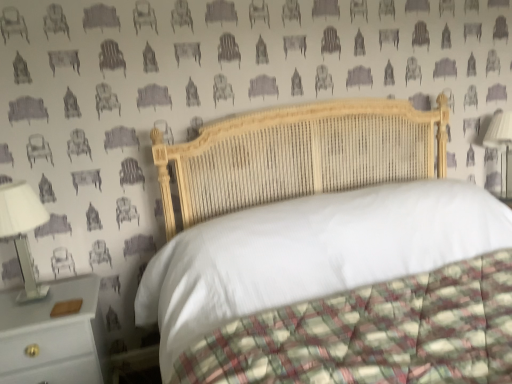
You are a GUI agent. You are given a task and a screenshot of the screen. Output one action in this format:
    pyautogui.click(x=<x>, y=<y>)
    Task: Click on the wooden bed at center
    The height and width of the screenshot is (384, 512).
    Given the screenshot: What is the action you would take?
    pyautogui.click(x=312, y=120)

Image resolution: width=512 pixels, height=384 pixels. Describe the element at coordinates (502, 148) in the screenshot. I see `white fabric lampshade at right, marked as the second bedside lamp in a left-to-right arrangement` at that location.

What do you see at coordinates (22, 230) in the screenshot? I see `white glossy bedside lamp at left, which appears as the 2th bedside lamp when viewed from the top` at bounding box center [22, 230].

The image size is (512, 384). Identify the location of wooden bed at center. (312, 120).

From a real-world perspective, who is located higher, white wood nightstand at lower left or white fabric lampshade at right, which appears as the second bedside lamp when ordered from the bottom?

white fabric lampshade at right, which appears as the second bedside lamp when ordered from the bottom.

In terms of width, does white wood nightstand at lower left look wider or thinner when compared to white fabric lampshade at right, which is the first bedside lamp in right-to-left order?

Clearly, white wood nightstand at lower left has more width compared to white fabric lampshade at right, which is the first bedside lamp in right-to-left order.

Which is in front, white wood nightstand at lower left or white fabric lampshade at right, which is the first bedside lamp in right-to-left order?

white wood nightstand at lower left is closer to the camera.

Would you say white wood nightstand at lower left is to the left or to the right of white fabric lampshade at right, which is the first bedside lamp in right-to-left order, in the picture?

white wood nightstand at lower left is positioned on white fabric lampshade at right, which is the first bedside lamp in right-to-left order,'s left side.

In the image, is wooden bed at center positioned in front of or behind white wood nightstand at lower left?

wooden bed at center is positioned closer to the viewer than white wood nightstand at lower left.

Is wooden bed at center oriented towards white wood nightstand at lower left?

No, wooden bed at center is not facing towards white wood nightstand at lower left.

How many degrees apart are the facing directions of wooden bed at center and white wood nightstand at lower left?

There is a 0.00264-degree angle between the facing directions of wooden bed at center and white wood nightstand at lower left.

From the picture: From the image's perspective, would you say wooden bed at center is positioned over white fabric lampshade at right, marked as the second bedside lamp in a left-to-right arrangement?

Incorrect, from the image's perspective, wooden bed at center is lower than white fabric lampshade at right, marked as the second bedside lamp in a left-to-right arrangement.

Which is more to the left, wooden bed at center or white fabric lampshade at right, marked as the first bedside lamp in a top-to-bottom arrangement?

wooden bed at center.

Looking at this image, can you confirm if wooden bed at center is taller than white fabric lampshade at right, which is the first bedside lamp from back to front?

Yes.

Can you confirm if wooden bed at center is taller than white glossy bedside lamp at left, which is counted as the first bedside lamp, starting from the bottom?

Correct, wooden bed at center is much taller as white glossy bedside lamp at left, which is counted as the first bedside lamp, starting from the bottom.

Does wooden bed at center lie in front of white glossy bedside lamp at left, which appears as the 2th bedside lamp when viewed from the right?

Yes, wooden bed at center is closer to the viewer.

Can you confirm if wooden bed at center is thinner than white glossy bedside lamp at left, arranged as the first bedside lamp when viewed from the front?

In fact, wooden bed at center might be wider than white glossy bedside lamp at left, arranged as the first bedside lamp when viewed from the front.

Is white glossy bedside lamp at left, which appears as the 2th bedside lamp when viewed from the right, completely or partially inside wooden bed at center?

No, white glossy bedside lamp at left, which appears as the 2th bedside lamp when viewed from the right, is not a part of wooden bed at center.

Which object is wider, white glossy bedside lamp at left, which appears as the 2th bedside lamp when viewed from the top, or white fabric lampshade at right, marked as the second bedside lamp in a left-to-right arrangement?

white fabric lampshade at right, marked as the second bedside lamp in a left-to-right arrangement.

Is white glossy bedside lamp at left, which is the 1th bedside lamp in left-to-right order, facing away from white fabric lampshade at right, marked as the second bedside lamp in a left-to-right arrangement?

No, white fabric lampshade at right, marked as the second bedside lamp in a left-to-right arrangement, is not at the back of white glossy bedside lamp at left, which is the 1th bedside lamp in left-to-right order.

Visually, is white glossy bedside lamp at left, which is the 2th bedside lamp in back-to-front order, positioned to the left or to the right of white fabric lampshade at right, the 2th bedside lamp in the front-to-back sequence?

In the image, white glossy bedside lamp at left, which is the 2th bedside lamp in back-to-front order, appears on the left side of white fabric lampshade at right, the 2th bedside lamp in the front-to-back sequence.

Does point (6, 187) appear closer or farther from the camera than point (490, 129)?

Clearly, point (6, 187) is closer to the camera than point (490, 129).

Is wooden bed at center at the back of white glossy bedside lamp at left, which is the 2th bedside lamp in back-to-front order?

No, wooden bed at center is not at the back of white glossy bedside lamp at left, which is the 2th bedside lamp in back-to-front order.

From the image's perspective, relative to wooden bed at center, is white glossy bedside lamp at left, which is counted as the first bedside lamp, starting from the bottom, above or below?

Based on their image positions, white glossy bedside lamp at left, which is counted as the first bedside lamp, starting from the bottom, is located above wooden bed at center.

Based on the photo, does white glossy bedside lamp at left, which appears as the 2th bedside lamp when viewed from the right, have a lesser height compared to wooden bed at center?

Yes, white glossy bedside lamp at left, which appears as the 2th bedside lamp when viewed from the right, is shorter than wooden bed at center.

Are white glossy bedside lamp at left, arranged as the first bedside lamp when viewed from the front, and wooden bed at center beside each other?

There is a gap between white glossy bedside lamp at left, arranged as the first bedside lamp when viewed from the front, and wooden bed at center.

Considering the positions of objects white glossy bedside lamp at left, which appears as the 2th bedside lamp when viewed from the top, and white wood nightstand at lower left in the image provided, who is in front, white glossy bedside lamp at left, which appears as the 2th bedside lamp when viewed from the top, or white wood nightstand at lower left?

white wood nightstand at lower left is in front.

Is white glossy bedside lamp at left, which appears as the 2th bedside lamp when viewed from the right, at the right side of white wood nightstand at lower left?

In fact, white glossy bedside lamp at left, which appears as the 2th bedside lamp when viewed from the right, is to the left of white wood nightstand at lower left.

Considering the sizes of objects white glossy bedside lamp at left, arranged as the first bedside lamp when viewed from the front, and white wood nightstand at lower left in the image provided, who is taller, white glossy bedside lamp at left, arranged as the first bedside lamp when viewed from the front, or white wood nightstand at lower left?

With more height is white wood nightstand at lower left.

Is white glossy bedside lamp at left, which is counted as the first bedside lamp, starting from the bottom, turned away from white wood nightstand at lower left?

No.

This screenshot has height=384, width=512. What are the coordinates of `nightstand that is under the white fabric lampshade at right, which is the first bedside lamp in right-to-left order (from a real-world perspective)` in the screenshot? It's located at (53, 336).

What are the coordinates of `bed lying on the right of white wood nightstand at lower left` in the screenshot? It's located at (312, 120).

Estimate the real-world distances between objects in this image. Which object is closer to wooden bed at center, white wood nightstand at lower left or white glossy bedside lamp at left, which is counted as the first bedside lamp, starting from the bottom?

Among the two, white wood nightstand at lower left is located nearer to wooden bed at center.

Based on their spatial positions, is white glossy bedside lamp at left, which appears as the 2th bedside lamp when viewed from the top, or wooden bed at center further from white wood nightstand at lower left?

wooden bed at center is positioned further to the anchor white wood nightstand at lower left.

Estimate the real-world distances between objects in this image. Which object is further from white wood nightstand at lower left, white fabric lampshade at right, which appears as the second bedside lamp when ordered from the bottom, or white glossy bedside lamp at left, arranged as the first bedside lamp when viewed from the front?

Among the two, white fabric lampshade at right, which appears as the second bedside lamp when ordered from the bottom, is located further to white wood nightstand at lower left.

From the image, which object appears to be nearer to white wood nightstand at lower left, wooden bed at center or white fabric lampshade at right, the 2th bedside lamp in the front-to-back sequence?

wooden bed at center is closer to white wood nightstand at lower left.

Based on their spatial positions, is white glossy bedside lamp at left, which is the 1th bedside lamp in left-to-right order, or white wood nightstand at lower left closer to wooden bed at center?

white wood nightstand at lower left is positioned closer to the anchor wooden bed at center.

From the image, which object appears to be farther from white wood nightstand at lower left, wooden bed at center or white glossy bedside lamp at left, which is the 1th bedside lamp in left-to-right order?

wooden bed at center is positioned further to the anchor white wood nightstand at lower left.

Which object lies nearer to the anchor point white glossy bedside lamp at left, which is the 2th bedside lamp in back-to-front order, white wood nightstand at lower left or wooden bed at center?

Among the two, white wood nightstand at lower left is located nearer to white glossy bedside lamp at left, which is the 2th bedside lamp in back-to-front order.

Based on their spatial positions, is white fabric lampshade at right, marked as the second bedside lamp in a left-to-right arrangement, or wooden bed at center closer to white wood nightstand at lower left?

wooden bed at center.

Identify the location of bed between white wood nightstand at lower left and white fabric lampshade at right, which appears as the second bedside lamp when ordered from the bottom, in the horizontal direction. This screenshot has height=384, width=512. (312, 120).

The height and width of the screenshot is (384, 512). I want to click on nightstand between white glossy bedside lamp at left, which is the 2th bedside lamp in back-to-front order, and white fabric lampshade at right, which appears as the second bedside lamp when ordered from the bottom, so click(x=53, y=336).

What are the coordinates of `bed between white glossy bedside lamp at left, which appears as the 2th bedside lamp when viewed from the top, and white fabric lampshade at right, which appears as the second bedside lamp when ordered from the bottom` in the screenshot? It's located at (312, 120).

Locate an element on the screen. Image resolution: width=512 pixels, height=384 pixels. nightstand located between white glossy bedside lamp at left, which appears as the 2th bedside lamp when viewed from the right, and wooden bed at center in the left-right direction is located at coordinates (53, 336).